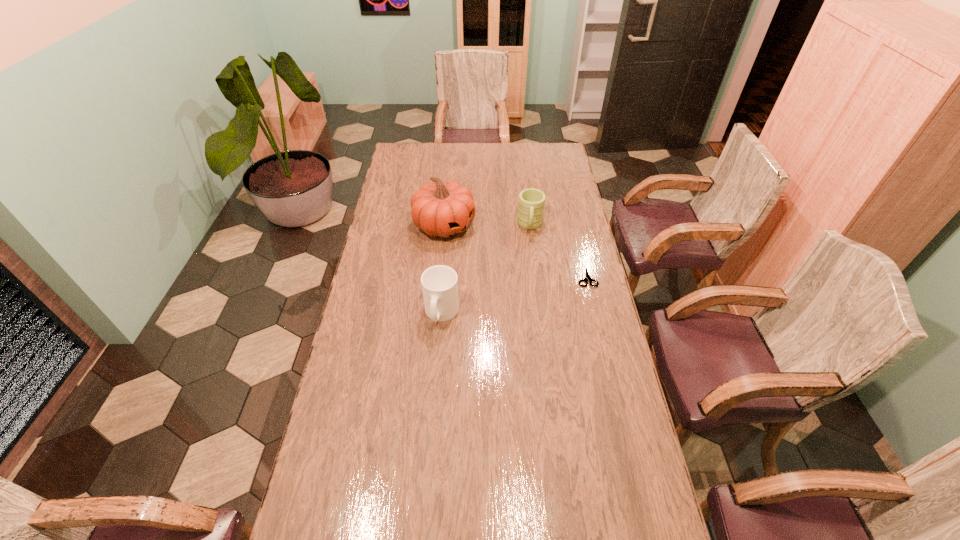
Locate an element on the screen. Image resolution: width=960 pixels, height=540 pixels. vacant space on the desktop that is between the left mug and the rightmost object and is positioned on the side of the right mug with the handle is located at coordinates (529, 292).

The image size is (960, 540). I want to click on vacant spot on the desktop that is between the nearest object and the third farthest object and is positioned on the face of the pumpkin, so click(538, 289).